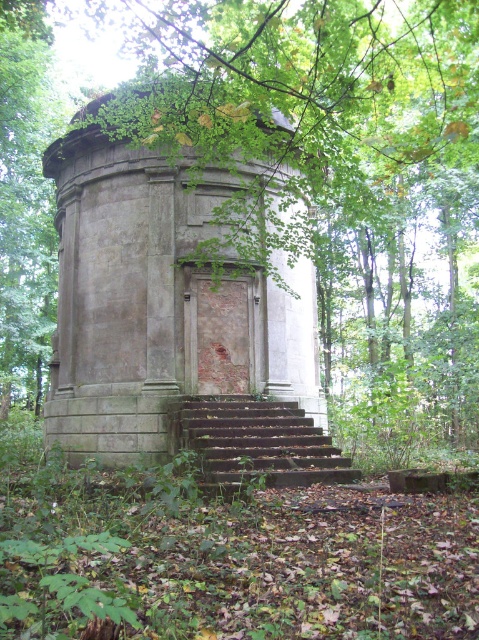
Question: Does gray stone monument at center have a smaller size compared to rusty metal stairs at center?

Choices:
 (A) no
 (B) yes

Answer: (A)

Question: Can you confirm if gray stone monument at center is wider than rusty metal stairs at center?

Choices:
 (A) no
 (B) yes

Answer: (B)

Question: Which point is closer to the camera taking this photo?

Choices:
 (A) (294, 481)
 (B) (86, 176)

Answer: (A)

Question: Considering the relative positions of gray stone monument at center and rusty metal stairs at center in the image provided, where is gray stone monument at center located with respect to rusty metal stairs at center?

Choices:
 (A) left
 (B) right

Answer: (A)

Question: Which object is closer to the camera taking this photo?

Choices:
 (A) rusty metal stairs at center
 (B) gray stone monument at center

Answer: (A)

Question: Which object is closer to the camera taking this photo?

Choices:
 (A) gray stone monument at center
 (B) rusty metal stairs at center

Answer: (B)